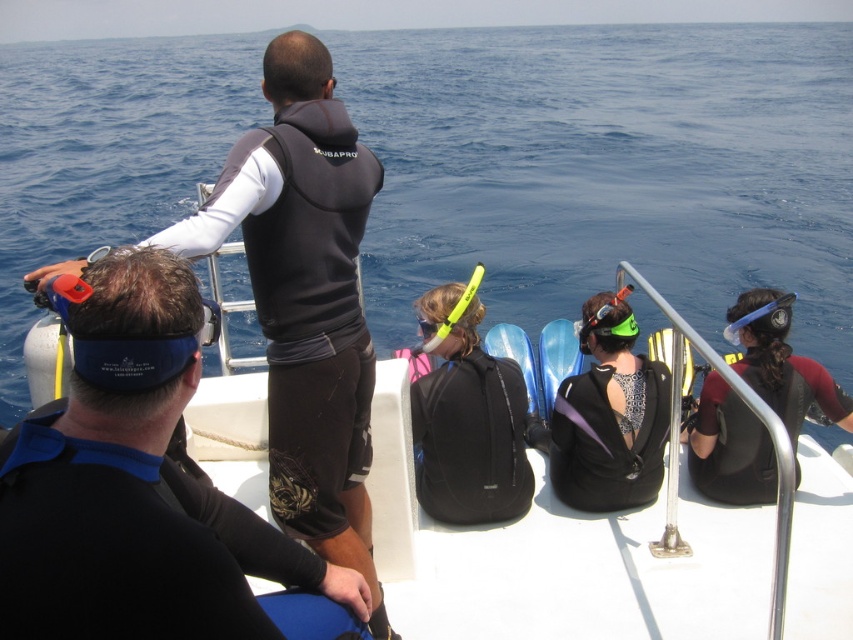
You are a diver preparing to store your gear. You have a black matte wetsuit at upper center and a black matte backpack at center. Which item takes up more space when stored?

The black matte wetsuit at upper center is larger in size than the black matte backpack at center, so it takes up more space when stored.